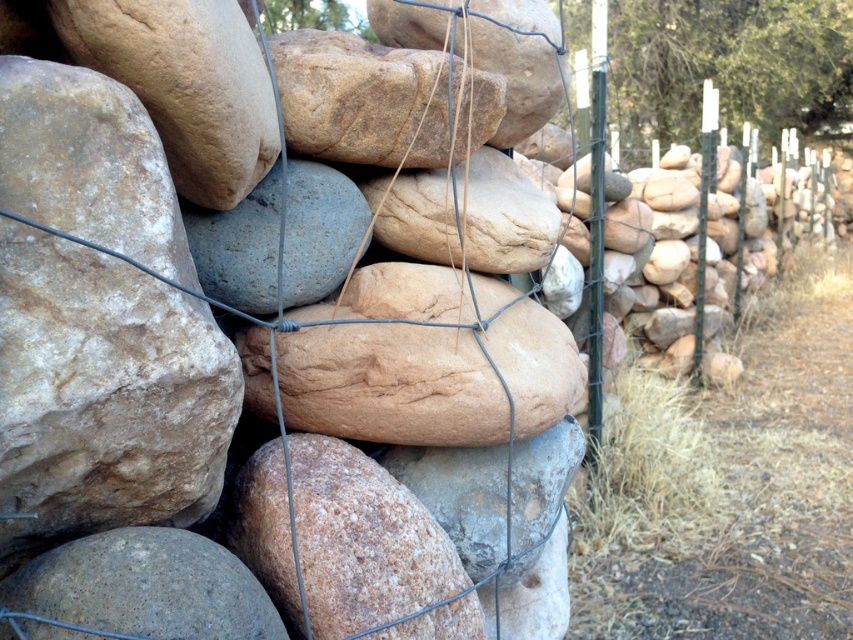
Based on the scene description, where is the natural stone at center located?

The natural stone at center is located at point (412, 365).

You are a landscape designer planning to place a small garden statue between the brown rough boulder at center and the smooth brown rock at center. Since the statue requires a base that is wider than the space between the two rocks, will you need to adjust the statue or the rocks?

The brown rough boulder at center is thinner than the smooth brown rock at center, so the space between them may be insufficient. You will need to adjust either the statue base or move the rocks closer together to accommodate the statue.

You are a gardener trying to place a new potted plant between the natural stone at center and the brown rough boulder at center. The pot is 20 centimeters wide. Can you fit it between them?

The natural stone at center and the brown rough boulder at center are 17.96 centimeters apart, so the 20 centimeter wide pot cannot fit between them as the distance is smaller than the pot.